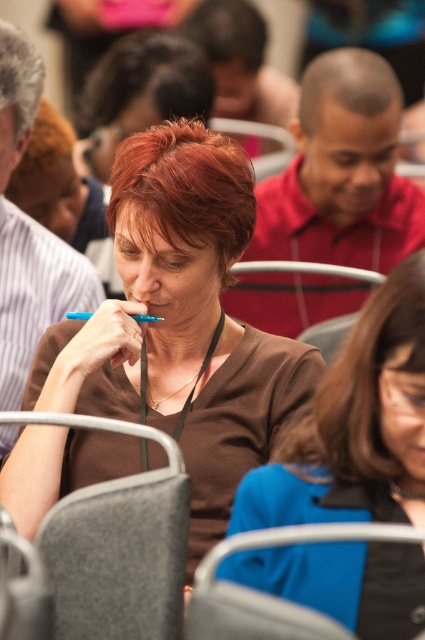
Is matte brown shirt at center closer to camera compared to gray fabric chair at lower center?

No, it is behind gray fabric chair at lower center.

Does matte brown shirt at center appear on the left side of gray fabric chair at lower center?

A: Yes, matte brown shirt at center is to the left of gray fabric chair at lower center.

Who is more distant from viewer, (190, 342) or (295, 616)?

Positioned behind is point (190, 342).

Where is `matte brown shirt at center`? Image resolution: width=425 pixels, height=640 pixels. matte brown shirt at center is located at coordinates (181, 323).

Consider the image. Is matte brown shirt at center closer to the viewer compared to brown matte shirt at center?

That is False.

Is point (280, 372) in front of point (272, 524)?

No, it is not.

Locate an element on the screen. matte brown shirt at center is located at coordinates pos(181,323).

What do you see at coordinates (346, 424) in the screenshot? I see `brown matte shirt at center` at bounding box center [346, 424].

Who is more forward, (289, 596) or (311, 531)?

Point (311, 531)

The height and width of the screenshot is (640, 425). In order to click on brown matte shirt at center in this screenshot , I will do `click(346, 424)`.